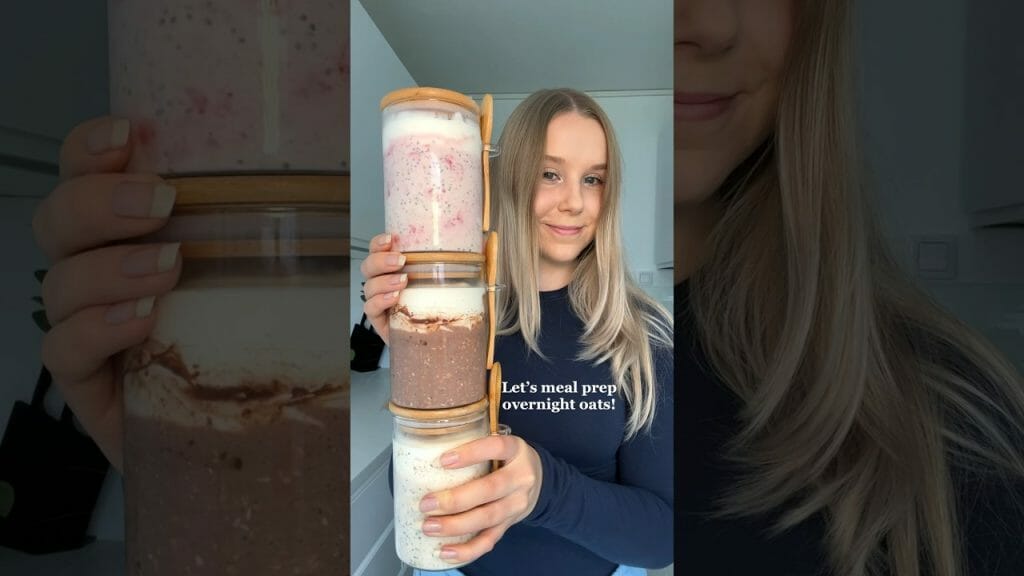
The width and height of the screenshot is (1024, 576). Identify the location of prepared meals inside of jars. pyautogui.click(x=412, y=469), pyautogui.click(x=441, y=356), pyautogui.click(x=443, y=188).